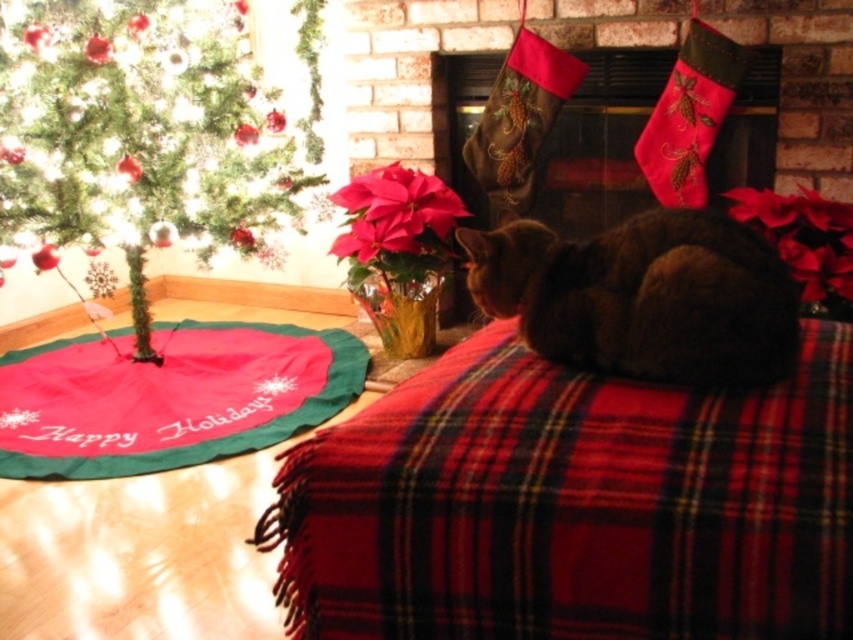
Where is `green matte christmas tree at lower left`? This screenshot has height=640, width=853. green matte christmas tree at lower left is located at coordinates (138, 134).

Image resolution: width=853 pixels, height=640 pixels. Describe the element at coordinates (138, 134) in the screenshot. I see `green matte christmas tree at lower left` at that location.

Does point (252, 120) come closer to viewer compared to point (575, 356)?

No, it is behind (575, 356).

Identify the location of green matte christmas tree at lower left. This screenshot has height=640, width=853. (138, 134).

Does point (315, 524) come in front of point (610, 276)?

Yes, it is.

Does point (462, 468) come farther from viewer compared to point (606, 237)?

No, it is in front of (606, 237).

Locate an element on the screen. Image resolution: width=853 pixels, height=640 pixels. red plaid blanket at center is located at coordinates pos(573,504).

Locate an element on the screen. Image resolution: width=853 pixels, height=640 pixels. red plaid blanket at center is located at coordinates (573, 504).

Image resolution: width=853 pixels, height=640 pixels. Describe the element at coordinates (643, 296) in the screenshot. I see `brown fur cat at center` at that location.

Does brown fur cat at center have a greater height compared to velvet green stockings at center?

Incorrect, brown fur cat at center's height is not larger of velvet green stockings at center's.

Between point (720, 360) and point (561, 129), which one is positioned in front?

Point (720, 360) is more forward.

Find the location of `brown fur cat at center`. brown fur cat at center is located at coordinates (643, 296).